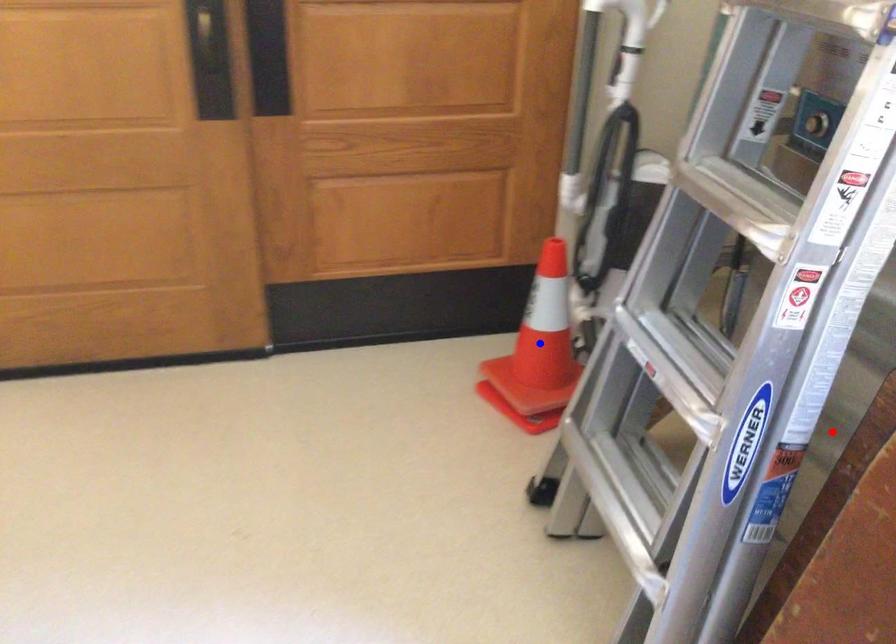
Question: Which of the two points in the image is closer to the camera?

Choices:
 (A) Blue point is closer.
 (B) Red point is closer.

Answer: (B)